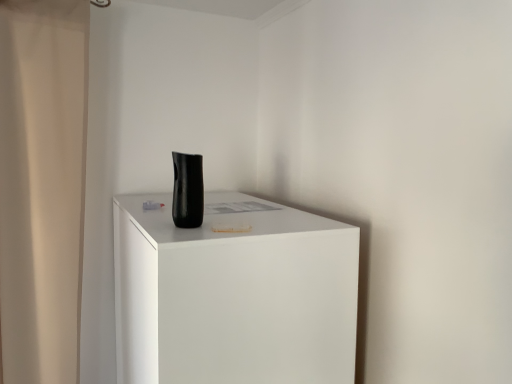
Locate an element on the screen. The width and height of the screenshot is (512, 384). vacant area that lies in front of black matte vase at center is located at coordinates (182, 238).